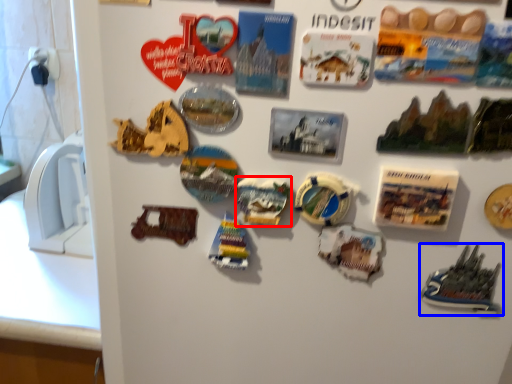
Question: Which point is further to the camera, stuff (highlighted by a red box) or toy (highlighted by a blue box)?

Choices:
 (A) stuff
 (B) toy

Answer: (A)